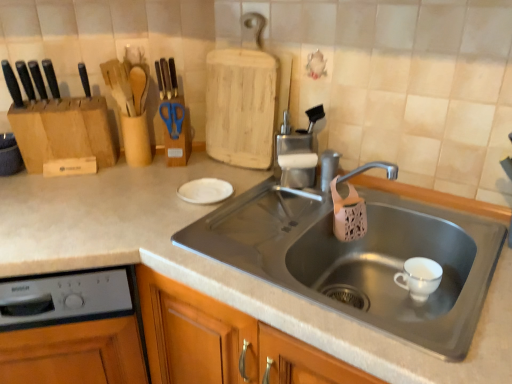
Image resolution: width=512 pixels, height=384 pixels. What are the coordinates of `black matte knife at left, which is the third knife from left to right` in the screenshot? It's located at (38, 79).

What are the coordinates of `blue plastic scissors at upper center` in the screenshot? It's located at (172, 117).

Considering the sizes of objects gray plastic dishwasher at lower left and blue plastic scissors at upper center in the image provided, who is thinner, gray plastic dishwasher at lower left or blue plastic scissors at upper center?

Thinner between the two is blue plastic scissors at upper center.

Is point (116, 335) closer or farther from the camera than point (167, 128)?

Point (116, 335) appears to be closer to the viewer than point (167, 128).

Is gray plastic dishwasher at lower left looking in the opposite direction of blue plastic scissors at upper center?

No, gray plastic dishwasher at lower left is not facing the opposite direction of blue plastic scissors at upper center.

Who is more distant, gray plastic dishwasher at lower left or blue plastic scissors at upper center?

Positioned behind is blue plastic scissors at upper center.

Considering the relative sizes of black plastic knife at left, which is the 2th knife in left-to-right order, and metallic gray sink at center in the image provided, is black plastic knife at left, which is the 2th knife in left-to-right order, thinner than metallic gray sink at center?

Indeed, black plastic knife at left, which is the 2th knife in left-to-right order, has a lesser width compared to metallic gray sink at center.

From the image's perspective, does black plastic knife at left, which is the 2th knife in left-to-right order, appear lower than metallic gray sink at center?

No, from the image's perspective, black plastic knife at left, which is the 2th knife in left-to-right order, is not beneath metallic gray sink at center.

Based on the photo, who is taller, black plastic knife at left, which is the 2th knife in left-to-right order, or metallic gray sink at center?

metallic gray sink at center.

Is the position of black plastic knife at left, marked as the 2th knife in a right-to-left arrangement, more distant than that of metallic gray sink at center?

Yes, the depth of black plastic knife at left, marked as the 2th knife in a right-to-left arrangement, is greater than that of metallic gray sink at center.

Who is shorter, blue plastic scissors at upper center or black matte knife at left, positioned as the first knife in right-to-left order?

blue plastic scissors at upper center is shorter.

Are blue plastic scissors at upper center and black matte knife at left, positioned as the first knife in right-to-left order, far apart?

No.

From a real-world perspective, which is physically below, blue plastic scissors at upper center or black matte knife at left, positioned as the first knife in right-to-left order?

blue plastic scissors at upper center is physically lower.

Between black matte knife at left, the first knife positioned from the left, and metallic gray sink at center, which one appears on the right side from the viewer's perspective?

metallic gray sink at center is more to the right.

Who is smaller, black matte knife at left, the first knife positioned from the left, or metallic gray sink at center?

With smaller size is black matte knife at left, the first knife positioned from the left.

Looking at this image, can you tell me how much black matte knife at left, positioned as the third knife in right-to-left order, and metallic gray sink at center differ in facing direction?

black matte knife at left, positioned as the third knife in right-to-left order, and metallic gray sink at center are facing 47.3 degrees away from each other.

Between black matte knife at left, positioned as the third knife in right-to-left order, and metallic gray sink at center, which one has more height?

metallic gray sink at center is taller.

In the scene shown: Which object is wider, gray plastic dishwasher at lower left or black matte knife at left, positioned as the first knife in right-to-left order?

gray plastic dishwasher at lower left.

Between gray plastic dishwasher at lower left and black matte knife at left, positioned as the first knife in right-to-left order, which one is positioned in front?

gray plastic dishwasher at lower left.

Would you say black matte knife at left, positioned as the first knife in right-to-left order, is part of gray plastic dishwasher at lower left's contents?

No, black matte knife at left, positioned as the first knife in right-to-left order, is not a part of gray plastic dishwasher at lower left.

From a real-world perspective, is gray plastic dishwasher at lower left located beneath black matte knife at left, positioned as the first knife in right-to-left order?

Indeed, from a real-world perspective, gray plastic dishwasher at lower left is positioned beneath black matte knife at left, positioned as the first knife in right-to-left order.

Considering the relative sizes of black plastic knife at left, which is the 2th knife in left-to-right order, and black matte knife at left, which is the third knife from left to right, in the image provided, is black plastic knife at left, which is the 2th knife in left-to-right order, smaller than black matte knife at left, which is the third knife from left to right,?

Correct, black plastic knife at left, which is the 2th knife in left-to-right order, occupies less space than black matte knife at left, which is the third knife from left to right.

Locate an element on the screen. the 1st knife below the black matte knife at left, positioned as the first knife in right-to-left order (from the image's perspective) is located at coordinates (25, 80).

Is black plastic knife at left, which is the 2th knife in left-to-right order, facing towards black matte knife at left, positioned as the first knife in right-to-left order?

No, black plastic knife at left, which is the 2th knife in left-to-right order, is not turned towards black matte knife at left, positioned as the first knife in right-to-left order.

The height and width of the screenshot is (384, 512). I want to click on scissors below the black matte knife at left, positioned as the third knife in right-to-left order (from the image's perspective), so click(172, 117).

Is black matte knife at left, the first knife positioned from the left, closer to camera compared to blue plastic scissors at upper center?

Yes, it is.

Can you confirm if black matte knife at left, the first knife positioned from the left, is taller than blue plastic scissors at upper center?

Correct, black matte knife at left, the first knife positioned from the left, is much taller as blue plastic scissors at upper center.

How distant is black matte knife at left, positioned as the third knife in right-to-left order, from blue plastic scissors at upper center?

They are 16.69 inches apart.

This screenshot has width=512, height=384. Identify the location of dish washer directly beneath the blue plastic scissors at upper center (from a real-world perspective). (71, 328).

This screenshot has width=512, height=384. Identify the location of countertop below the black plastic knife at left, which is the 2th knife in left-to-right order (from the image's perspective). (217, 264).

When comparing their distances from blue plastic scissors at upper center, does black matte knife at left, the first knife positioned from the left, or black matte knife at left, positioned as the first knife in right-to-left order, seem further?

black matte knife at left, the first knife positioned from the left, lies further to blue plastic scissors at upper center than the other object.

Looking at the image, which one is located closer to metallic gray sink at center, blue plastic scissors at upper center or gray plastic dishwasher at lower left?

gray plastic dishwasher at lower left.

From the image, which object appears to be farther from black matte knife at left, which is the third knife from left to right, metallic gray sink at center or blue plastic scissors at upper center?

metallic gray sink at center.

Looking at the image, which one is located closer to blue plastic scissors at upper center, black plastic knife at left, which is the 2th knife in left-to-right order, or black matte knife at left, which is the third knife from left to right?

Based on the image, black matte knife at left, which is the third knife from left to right, appears to be nearer to blue plastic scissors at upper center.

Based on their spatial positions, is metallic gray sink at center or black plastic knife at left, marked as the 2th knife in a right-to-left arrangement, further from blue plastic scissors at upper center?

metallic gray sink at center is further to blue plastic scissors at upper center.

Which object lies further to the anchor point black matte knife at left, positioned as the third knife in right-to-left order, black matte knife at left, positioned as the first knife in right-to-left order, or gray plastic dishwasher at lower left?

gray plastic dishwasher at lower left.

Estimate the real-world distances between objects in this image. Which object is closer to metallic gray sink at center, black matte knife at left, positioned as the third knife in right-to-left order, or black matte knife at left, which is the third knife from left to right?

Based on the image, black matte knife at left, positioned as the third knife in right-to-left order, appears to be nearer to metallic gray sink at center.

Based on their spatial positions, is metallic gray sink at center or gray plastic dishwasher at lower left further from black plastic knife at left, which is the 2th knife in left-to-right order?

gray plastic dishwasher at lower left.

Locate an element on the screen. dish washer between black matte knife at left, positioned as the third knife in right-to-left order, and metallic gray sink at center, in the horizontal direction is located at coordinates (71, 328).

Image resolution: width=512 pixels, height=384 pixels. Identify the location of scissors between black plastic knife at left, marked as the 2th knife in a right-to-left arrangement, and gray plastic dishwasher at lower left from top to bottom. (172, 117).

Where is `scissors between black matte knife at left, which is the third knife from left to right, and gray plastic dishwasher at lower left from top to bottom`? This screenshot has height=384, width=512. scissors between black matte knife at left, which is the third knife from left to right, and gray plastic dishwasher at lower left from top to bottom is located at coordinates (172, 117).

Image resolution: width=512 pixels, height=384 pixels. Identify the location of scissors between black matte knife at left, the first knife positioned from the left, and metallic gray sink at center, in the horizontal direction. (172, 117).